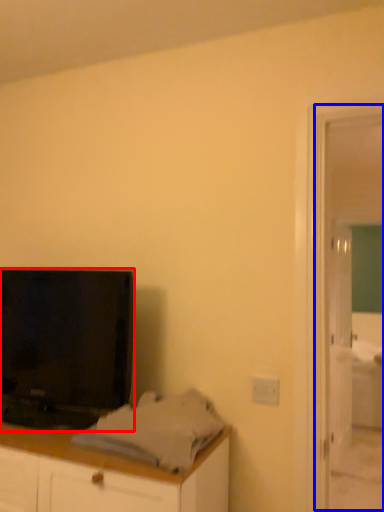
Question: Which object is further to the camera taking this photo, television (highlighted by a red box) or screen door (highlighted by a blue box)?

Choices:
 (A) television
 (B) screen door

Answer: (B)